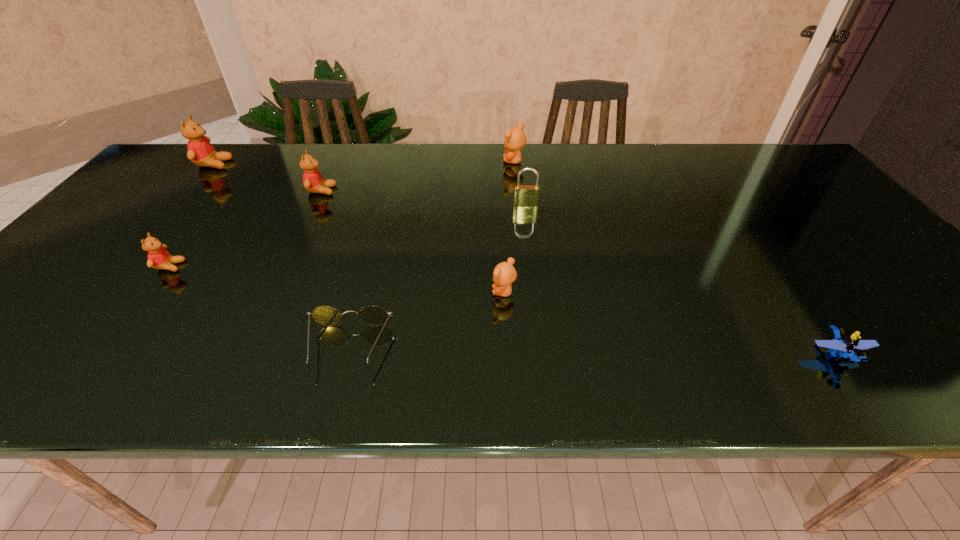
Where is `free spot located 0.390m on the front-facing side of the padlock`? This screenshot has height=540, width=960. free spot located 0.390m on the front-facing side of the padlock is located at coordinates (540, 314).

Locate an element on the screen. This screenshot has width=960, height=540. free space located 0.310m on the face of the smaller brown teddy bear is located at coordinates (352, 292).

Locate an element on the screen. The height and width of the screenshot is (540, 960). vacant space located on the face of the smaller brown teddy bear is located at coordinates (411, 292).

Where is `vacant space located on the face of the smaller brown teddy bear`? vacant space located on the face of the smaller brown teddy bear is located at coordinates (434, 292).

Find the location of a particular element. vacant space situated 0.110m on the front-facing side of the fourth teddy bear from right to left is located at coordinates (229, 266).

This screenshot has width=960, height=540. Identify the location of Lego located at the near edge. (846, 344).

Locate an element on the screen. This screenshot has height=540, width=960. spectacles present at the near edge is located at coordinates tap(371, 315).

You are a GUI agent. You are given a task and a screenshot of the screen. Output one action in this format:
    pyautogui.click(x=<x>, y=<y>)
    Task: Click on the object that is positioned at the left edge
    This screenshot has width=960, height=540.
    Given the screenshot: What is the action you would take?
    pyautogui.click(x=200, y=151)

Locate an element on the screen. The width and height of the screenshot is (960, 540). object that is positioned at the far left corner is located at coordinates (200, 151).

Locate an element on the screen. This screenshot has width=960, height=540. free space at the far edge is located at coordinates (338, 176).